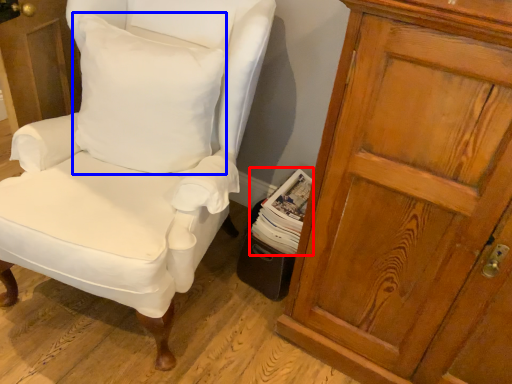
Question: Among these objects, which one is farthest to the camera, magazine (highlighted by a red box) or pillow (highlighted by a blue box)?

Choices:
 (A) magazine
 (B) pillow

Answer: (A)